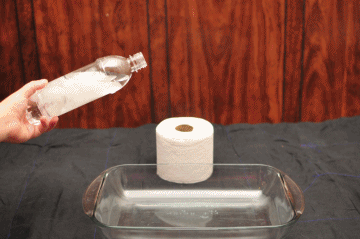
At what (x,y) coordinates should I click in order to perform the action: click on bottle. Please return your answer as a coordinate pair (x, y). Image resolution: width=360 pixels, height=239 pixels. Looking at the image, I should click on (163, 49).